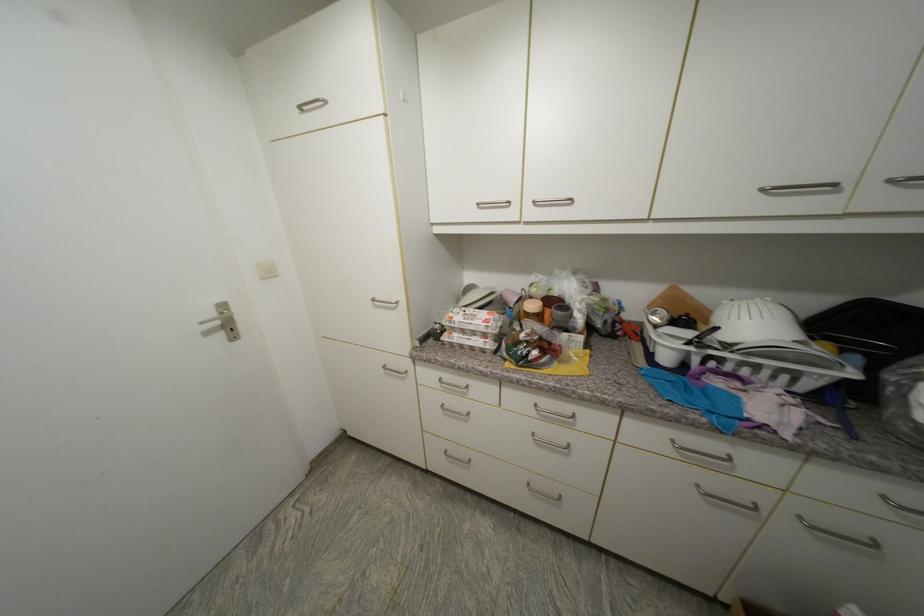
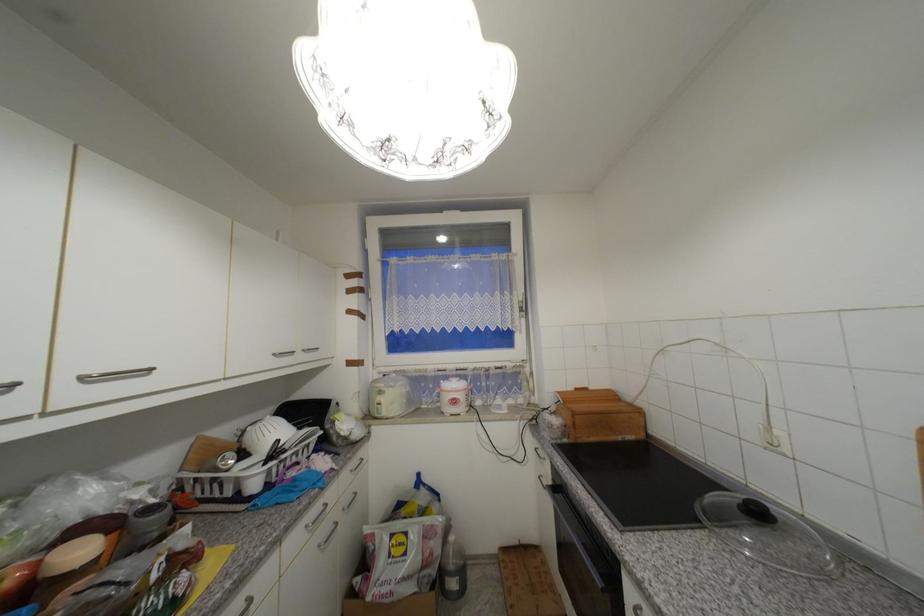
Find the pixel in the second image that matches (540,204) in the first image.

(89, 379)